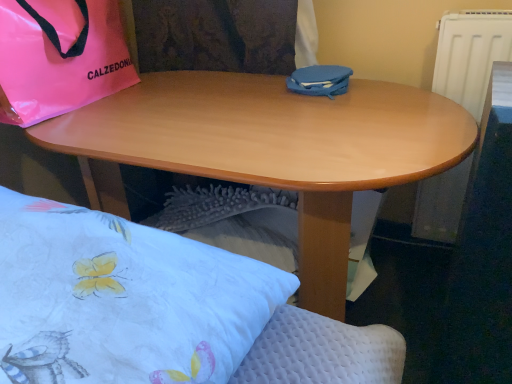
The width and height of the screenshot is (512, 384). What are the coordinates of `spots to the right of blue matte case at center` in the screenshot? It's located at (392, 90).